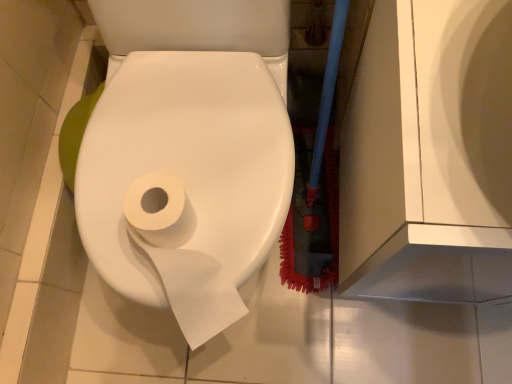
The height and width of the screenshot is (384, 512). What are the coordinates of `white matte toilet paper at center, acting as the first toilet paper starting from the back` in the screenshot? It's located at (181, 258).

Describe the element at coordinates (181, 258) in the screenshot. I see `white matte toilet paper at center, acting as the second toilet paper starting from the front` at that location.

Describe the element at coordinates (185, 181) in the screenshot. Image resolution: width=512 pixels, height=384 pixels. I see `white matte toilet paper at center, which appears as the first toilet paper when viewed from the front` at that location.

I want to click on white matte toilet paper at center, which appears as the first toilet paper when viewed from the front, so [185, 181].

Find the location of a particular element. The image size is (512, 384). white matte toilet paper at center, acting as the second toilet paper starting from the front is located at coordinates (181, 258).

Does white matte toilet paper at center, acting as the second toilet paper starting from the front, appear on the left side of white matte toilet paper at center, which is the second toilet paper from back to front?

Correct, you'll find white matte toilet paper at center, acting as the second toilet paper starting from the front, to the left of white matte toilet paper at center, which is the second toilet paper from back to front.

Relative to white matte toilet paper at center, which appears as the first toilet paper when viewed from the front, is white matte toilet paper at center, acting as the first toilet paper starting from the back, in front or behind?

white matte toilet paper at center, acting as the first toilet paper starting from the back, is positioned farther from the viewer than white matte toilet paper at center, which appears as the first toilet paper when viewed from the front.

Is point (190, 338) positioned in front of point (187, 139)?

Yes, point (190, 338) is closer to viewer.

From the image's perspective, between white matte toilet paper at center, acting as the second toilet paper starting from the front, and white matte toilet paper at center, which is the second toilet paper from back to front, which one is located above?

From the image's view, white matte toilet paper at center, which is the second toilet paper from back to front, is above.

From a real-world perspective, is white matte toilet paper at center, acting as the first toilet paper starting from the back, positioned under white matte toilet paper at center, which is the second toilet paper from back to front, based on gravity?

No, from a real-world perspective, white matte toilet paper at center, acting as the first toilet paper starting from the back, is not under white matte toilet paper at center, which is the second toilet paper from back to front.

Considering the sizes of objects white matte toilet paper at center, acting as the first toilet paper starting from the back, and white matte toilet paper at center, which is the second toilet paper from back to front, in the image provided, who is thinner, white matte toilet paper at center, acting as the first toilet paper starting from the back, or white matte toilet paper at center, which is the second toilet paper from back to front,?

white matte toilet paper at center, acting as the first toilet paper starting from the back, is thinner.

Who is taller, white matte toilet paper at center, acting as the second toilet paper starting from the front, or white matte toilet paper at center, which is the second toilet paper from back to front?

With more height is white matte toilet paper at center, which is the second toilet paper from back to front.

Between white matte toilet paper at center, acting as the first toilet paper starting from the back, and white matte toilet paper at center, which appears as the first toilet paper when viewed from the front, which one has smaller size?

Smaller between the two is white matte toilet paper at center, acting as the first toilet paper starting from the back.

Which is correct: white matte toilet paper at center, acting as the first toilet paper starting from the back, is inside white matte toilet paper at center, which appears as the first toilet paper when viewed from the front, or outside of it?

white matte toilet paper at center, acting as the first toilet paper starting from the back, is enclosed within white matte toilet paper at center, which appears as the first toilet paper when viewed from the front.

Is white matte toilet paper at center, acting as the first toilet paper starting from the back, directly adjacent to white matte toilet paper at center, which appears as the first toilet paper when viewed from the front?

Yes, white matte toilet paper at center, acting as the first toilet paper starting from the back, is in contact with white matte toilet paper at center, which appears as the first toilet paper when viewed from the front.

Could you tell me if white matte toilet paper at center, acting as the first toilet paper starting from the back, is facing white matte toilet paper at center, which is the second toilet paper from back to front?

Yes, white matte toilet paper at center, acting as the first toilet paper starting from the back, is facing white matte toilet paper at center, which is the second toilet paper from back to front.

How many degrees apart are the facing directions of white matte toilet paper at center, acting as the second toilet paper starting from the front, and white matte toilet paper at center, which is the second toilet paper from back to front?

2.41 degrees.

How distant is white matte toilet paper at center, acting as the first toilet paper starting from the back, from white matte toilet paper at center, which appears as the first toilet paper when viewed from the front?

3.27 inches.

I want to click on toilet paper lying behind the white matte toilet paper at center, which appears as the first toilet paper when viewed from the front, so click(181, 258).

Is white matte toilet paper at center, which appears as the first toilet paper when viewed from the front, at the right side of white matte toilet paper at center, acting as the second toilet paper starting from the front?

Yes, white matte toilet paper at center, which appears as the first toilet paper when viewed from the front, is to the right of white matte toilet paper at center, acting as the second toilet paper starting from the front.

Looking at this image, between white matte toilet paper at center, which appears as the first toilet paper when viewed from the front, and white matte toilet paper at center, acting as the first toilet paper starting from the back, which one is positioned behind?

white matte toilet paper at center, acting as the first toilet paper starting from the back, is more distant.

Which is less distant, (161,196) or (158,184)?

The point (158,184) is closer.

From the image's perspective, is white matte toilet paper at center, which is the second toilet paper from back to front, located above white matte toilet paper at center, acting as the second toilet paper starting from the front?

Yes, from the image's perspective, white matte toilet paper at center, which is the second toilet paper from back to front, is on top of white matte toilet paper at center, acting as the second toilet paper starting from the front.

From a real-world perspective, which is physically above, white matte toilet paper at center, which is the second toilet paper from back to front, or white matte toilet paper at center, acting as the first toilet paper starting from the back?

white matte toilet paper at center, acting as the first toilet paper starting from the back, from a real-world perspective.

Consider the image. Is white matte toilet paper at center, which is the second toilet paper from back to front, wider than white matte toilet paper at center, acting as the second toilet paper starting from the front?

Yes.

Can you confirm if white matte toilet paper at center, which is the second toilet paper from back to front, is shorter than white matte toilet paper at center, acting as the second toilet paper starting from the front?

Incorrect, the height of white matte toilet paper at center, which is the second toilet paper from back to front, does not fall short of that of white matte toilet paper at center, acting as the second toilet paper starting from the front.

Consider the image. Which of these two, white matte toilet paper at center, which appears as the first toilet paper when viewed from the front, or white matte toilet paper at center, acting as the second toilet paper starting from the front, is bigger?

white matte toilet paper at center, which appears as the first toilet paper when viewed from the front.

Looking at this image, is white matte toilet paper at center, which is the second toilet paper from back to front, situated inside white matte toilet paper at center, acting as the second toilet paper starting from the front, or outside?

The correct answer is: outside.

Is the surface of white matte toilet paper at center, which is the second toilet paper from back to front, in direct contact with white matte toilet paper at center, acting as the second toilet paper starting from the front?

Yes, white matte toilet paper at center, which is the second toilet paper from back to front, is in contact with white matte toilet paper at center, acting as the second toilet paper starting from the front.

Is white matte toilet paper at center, which appears as the first toilet paper when viewed from the front, looking in the opposite direction of white matte toilet paper at center, acting as the second toilet paper starting from the front?

No, white matte toilet paper at center, which appears as the first toilet paper when viewed from the front, is not facing the opposite direction of white matte toilet paper at center, acting as the second toilet paper starting from the front.

What are the coordinates of `toilet paper below the white matte toilet paper at center, which is the second toilet paper from back to front (from the image's perspective)` in the screenshot? It's located at (181, 258).

Where is `toilet paper located behind the white matte toilet paper at center, which is the second toilet paper from back to front`? This screenshot has width=512, height=384. toilet paper located behind the white matte toilet paper at center, which is the second toilet paper from back to front is located at coordinates (181, 258).

At what (x,y) coordinates should I click in order to perform the action: click on toilet paper above the white matte toilet paper at center, which is the second toilet paper from back to front (from a real-world perspective). Please return your answer as a coordinate pair (x, y). Looking at the image, I should click on (181, 258).